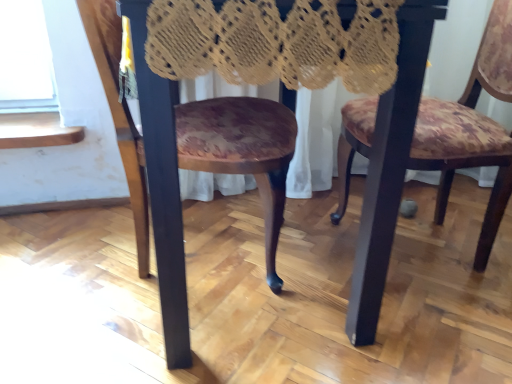
How much space does floral fabric chair at center, which is the first chair in right-to-left order, occupy horizontally?

The width of floral fabric chair at center, which is the first chair in right-to-left order, is 20.34 inches.

This screenshot has height=384, width=512. Identify the location of wooden floral-patterned chair at center, which is the second chair from right to left. (162, 190).

Considering the sizes of wooden table at center and floral fabric chair at center, marked as the second chair in a left-to-right arrangement, in the image, is wooden table at center wider or thinner than floral fabric chair at center, marked as the second chair in a left-to-right arrangement,?

Clearly, wooden table at center has more width compared to floral fabric chair at center, marked as the second chair in a left-to-right arrangement.

From the image's perspective, which object appears higher, wooden table at center or floral fabric chair at center, which is the first chair in right-to-left order?

From the image's view, floral fabric chair at center, which is the first chair in right-to-left order, is above.

Image resolution: width=512 pixels, height=384 pixels. In order to click on table below the floral fabric chair at center, marked as the second chair in a left-to-right arrangement (from the image's perspective) in this screenshot , I will do `click(161, 173)`.

Is floral fabric chair at center, which is the first chair in right-to-left order, inside wooden table at center?

Definitely not — floral fabric chair at center, which is the first chair in right-to-left order, is not inside wooden table at center.

Who is shorter, wooden floral-patterned chair at center, which is the second chair from right to left, or wooden table at center?

wooden floral-patterned chair at center, which is the second chair from right to left, is shorter.

Find the location of a particular element. This screenshot has height=384, width=512. table above the wooden floral-patterned chair at center, which is the second chair from right to left (from the image's perspective) is located at coordinates (161, 173).

Is wooden floral-patterned chair at center, which is the second chair from right to left, to the right of wooden table at center from the viewer's perspective?

Incorrect, wooden floral-patterned chair at center, which is the second chair from right to left, is not on the right side of wooden table at center.

Measure the distance between floral fabric chair at center, which is the first chair in right-to-left order, and wooden table at center.

They are 18.72 inches apart.

Locate an element on the screen. The width and height of the screenshot is (512, 384). table in front of the floral fabric chair at center, which is the first chair in right-to-left order is located at coordinates 161,173.

Consider the image. Is floral fabric chair at center, which is the first chair in right-to-left order, at the left side of wooden table at center?

No.

Considering the positions of objects floral fabric chair at center, marked as the second chair in a left-to-right arrangement, and wooden floral-patterned chair at center, which is the second chair from right to left, in the image provided, who is in front, floral fabric chair at center, marked as the second chair in a left-to-right arrangement, or wooden floral-patterned chair at center, which is the second chair from right to left,?

wooden floral-patterned chair at center, which is the second chair from right to left, is more forward.

From a real-world perspective, which object stands above the other?

floral fabric chair at center, marked as the second chair in a left-to-right arrangement, is physically above.

Considering the relative sizes of floral fabric chair at center, which is the first chair in right-to-left order, and wooden floral-patterned chair at center, placed as the 1th chair when sorted from left to right, in the image provided, is floral fabric chair at center, which is the first chair in right-to-left order, wider than wooden floral-patterned chair at center, placed as the 1th chair when sorted from left to right,?

Incorrect, the width of floral fabric chair at center, which is the first chair in right-to-left order, does not surpass that of wooden floral-patterned chair at center, placed as the 1th chair when sorted from left to right.

Looking at the image, does floral fabric chair at center, marked as the second chair in a left-to-right arrangement, seem bigger or smaller compared to wooden floral-patterned chair at center, which is the second chair from right to left?

In the image, floral fabric chair at center, marked as the second chair in a left-to-right arrangement, appears to be larger than wooden floral-patterned chair at center, which is the second chair from right to left.

From the picture: Is wooden floral-patterned chair at center, placed as the 1th chair when sorted from left to right, positioned in front of floral fabric chair at center, which is the first chair in right-to-left order?

Yes, the depth of wooden floral-patterned chair at center, placed as the 1th chair when sorted from left to right, is less than that of floral fabric chair at center, which is the first chair in right-to-left order.

From a real-world perspective, between wooden floral-patterned chair at center, which is the second chair from right to left, and floral fabric chair at center, which is the first chair in right-to-left order, who is vertically lower?

wooden floral-patterned chair at center, which is the second chair from right to left, from a real-world perspective.

Where is `chair behind the wooden floral-patterned chair at center, which is the second chair from right to left`? This screenshot has height=384, width=512. chair behind the wooden floral-patterned chair at center, which is the second chair from right to left is located at coordinates (472, 129).

How distant is wooden table at center from wooden floral-patterned chair at center, which is the second chair from right to left?

wooden table at center and wooden floral-patterned chair at center, which is the second chair from right to left, are 2.45 inches apart from each other.

Is wooden table at center positioned beyond the bounds of wooden floral-patterned chair at center, which is the second chair from right to left?

No.

From the image's perspective, is wooden table at center above or below wooden floral-patterned chair at center, which is the second chair from right to left?

Clearly, from the image's perspective, wooden table at center is above wooden floral-patterned chair at center, which is the second chair from right to left.

From a real-world perspective, who is located lower, wooden table at center or wooden floral-patterned chair at center, which is the second chair from right to left?

wooden floral-patterned chair at center, which is the second chair from right to left, is physically lower.

Where is `chair lying on the right of wooden table at center`? chair lying on the right of wooden table at center is located at coordinates (472, 129).

Find the location of `table lying above the wooden floral-patterned chair at center, which is the second chair from right to left (from the image's perspective)`. table lying above the wooden floral-patterned chair at center, which is the second chair from right to left (from the image's perspective) is located at coordinates (161, 173).

Which object lies further to the anchor point wooden floral-patterned chair at center, placed as the 1th chair when sorted from left to right, floral fabric chair at center, marked as the second chair in a left-to-right arrangement, or wooden table at center?

Based on the image, floral fabric chair at center, marked as the second chair in a left-to-right arrangement, appears to be further to wooden floral-patterned chair at center, placed as the 1th chair when sorted from left to right.

Considering their positions, is wooden table at center positioned further to wooden floral-patterned chair at center, placed as the 1th chair when sorted from left to right, than floral fabric chair at center, marked as the second chair in a left-to-right arrangement?

floral fabric chair at center, marked as the second chair in a left-to-right arrangement, is positioned further to the anchor wooden floral-patterned chair at center, placed as the 1th chair when sorted from left to right.

Considering their positions, is floral fabric chair at center, which is the first chair in right-to-left order, positioned closer to wooden table at center than wooden floral-patterned chair at center, which is the second chair from right to left?

Based on the image, wooden floral-patterned chair at center, which is the second chair from right to left, appears to be nearer to wooden table at center.

When comparing their distances from floral fabric chair at center, which is the first chair in right-to-left order, does wooden floral-patterned chair at center, which is the second chair from right to left, or wooden table at center seem further?

wooden floral-patterned chair at center, which is the second chair from right to left, lies further to floral fabric chair at center, which is the first chair in right-to-left order, than the other object.

Looking at the image, which one is located closer to wooden table at center, wooden floral-patterned chair at center, placed as the 1th chair when sorted from left to right, or floral fabric chair at center, which is the first chair in right-to-left order?

wooden floral-patterned chair at center, placed as the 1th chair when sorted from left to right, lies closer to wooden table at center than the other object.

In the scene shown: Which object lies nearer to the anchor point floral fabric chair at center, marked as the second chair in a left-to-right arrangement, wooden table at center or wooden floral-patterned chair at center, placed as the 1th chair when sorted from left to right?

wooden table at center is closer to floral fabric chair at center, marked as the second chair in a left-to-right arrangement.

Find the location of `table between wooden floral-patterned chair at center, which is the second chair from right to left, and floral fabric chair at center, which is the first chair in right-to-left order, in the horizontal direction`. table between wooden floral-patterned chair at center, which is the second chair from right to left, and floral fabric chair at center, which is the first chair in right-to-left order, in the horizontal direction is located at coordinates (161, 173).